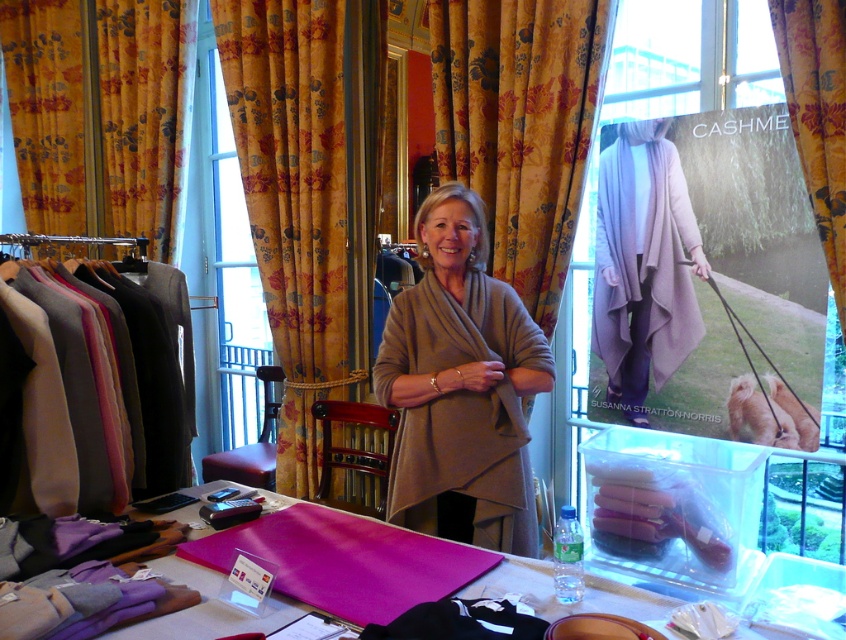
Consider the image. Can you confirm if yellow floral fabric at upper left is positioned above pink fabric at center?

Yes.

Is yellow floral fabric at upper left closer to the viewer compared to pink fabric at center?

No, yellow floral fabric at upper left is behind pink fabric at center.

Image resolution: width=846 pixels, height=640 pixels. Find the location of `yellow floral fabric at upper left`. yellow floral fabric at upper left is located at coordinates (102, 113).

Does yellow floral fabric curtain at center appear over yellow floral fabric at upper left?

Incorrect, yellow floral fabric curtain at center is not positioned above yellow floral fabric at upper left.

Between yellow floral fabric curtain at center and yellow floral fabric at upper left, which one appears on the right side from the viewer's perspective?

yellow floral fabric curtain at center is more to the right.

The height and width of the screenshot is (640, 846). Find the location of `yellow floral fabric curtain at center`. yellow floral fabric curtain at center is located at coordinates (294, 198).

Who is taller, yellow floral fabric curtain at center or matte wool sweater at left?

With more height is yellow floral fabric curtain at center.

I want to click on yellow floral fabric curtain at center, so click(x=294, y=198).

Identify the location of yellow floral fabric curtain at center. This screenshot has height=640, width=846. (294, 198).